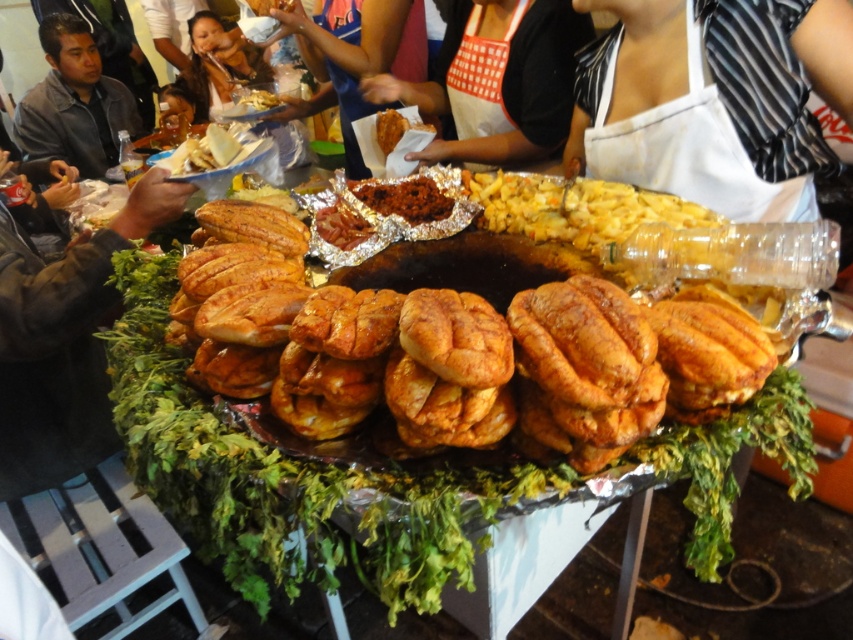
From the picture: You are standing in front of the food stall and want to locate the dark gray shirt at left. Where should you look relative to the grill?

The dark gray shirt at left is located at the coordinates point (74, 102) relative to the grill.

You are a food vendor at the market and need to determine which item is bigger between the golden crispy bread at center and the white apron at center. Which one should you choose?

The golden crispy bread at center is larger in size than the white apron at center, so you should choose the golden crispy bread at center.